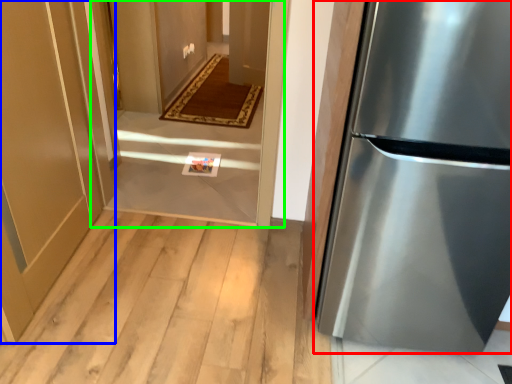
Question: Considering the real-world distances, which object is closest to refrigerator (highlighted by a red box)? door (highlighted by a blue box) or corridor (highlighted by a green box).

Choices:
 (A) door
 (B) corridor

Answer: (B)